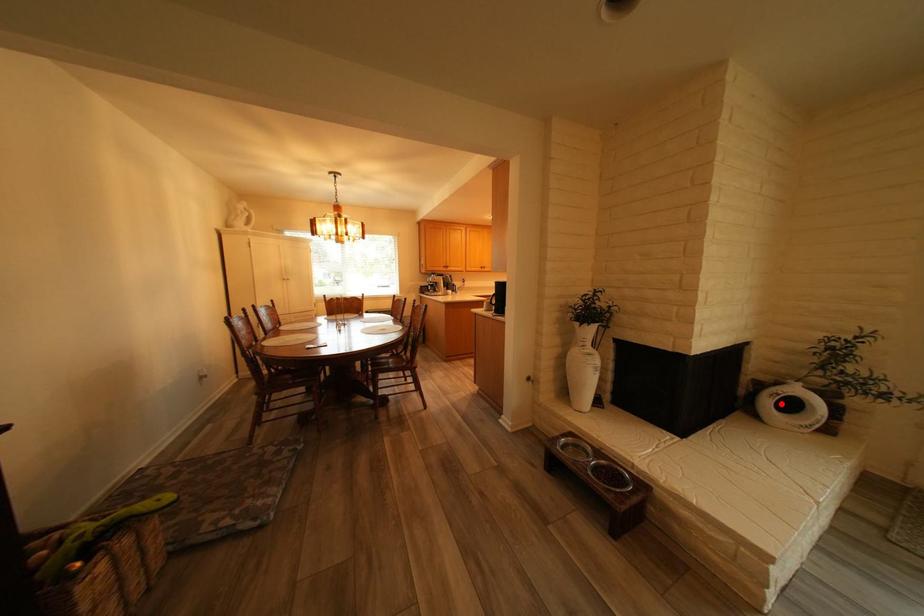
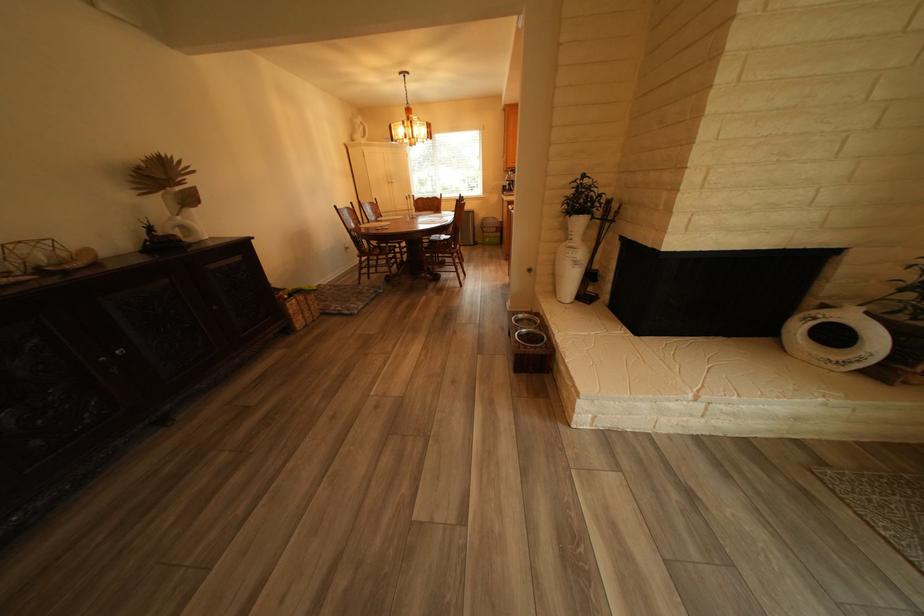
Where in the second image is the point corresponding to the highlighted location from the first image?

(810, 329)